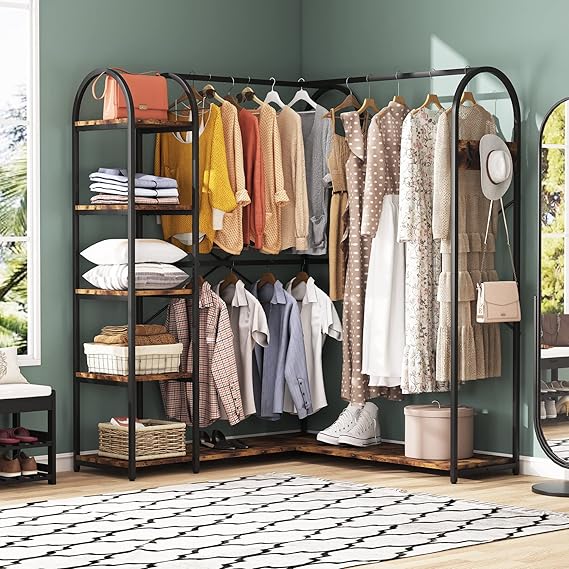
The width and height of the screenshot is (569, 569). Find the location of `folded fabrics`. folded fabrics is located at coordinates (154, 174), (163, 192), (170, 201), (154, 325), (163, 337).